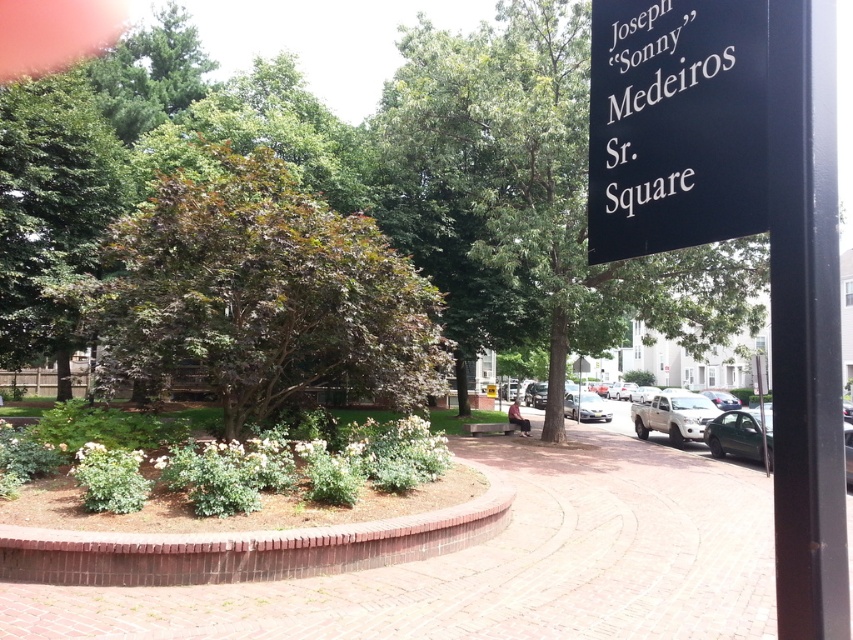
Question: Which object is closer to the camera taking this photo?

Choices:
 (A) black plastic sign at upper right
 (B) brick pavement at center
 (C) black metal pole at right

Answer: (C)

Question: Which object appears farthest from the camera in this image?

Choices:
 (A) silver metallic pickup truck at center-right
 (B) white matte pickup truck at center
 (C) black metal pole at right
 (D) brick pavement at center

Answer: (A)

Question: Can you confirm if purple-leaved shrub at center-left is positioned below green leafy tree at left?

Choices:
 (A) no
 (B) yes

Answer: (A)

Question: Is green leafy tree at center below black metal pole at right?

Choices:
 (A) no
 (B) yes

Answer: (A)

Question: Considering the relative positions of purple-leaved shrub at center-left and black metal pole at right in the image provided, where is purple-leaved shrub at center-left located with respect to black metal pole at right?

Choices:
 (A) right
 (B) left

Answer: (B)

Question: Which of the following is the closest to the observer?

Choices:
 (A) purple-leaved shrub at center-left
 (B) green leafy tree at left
 (C) black metal pole at right

Answer: (C)